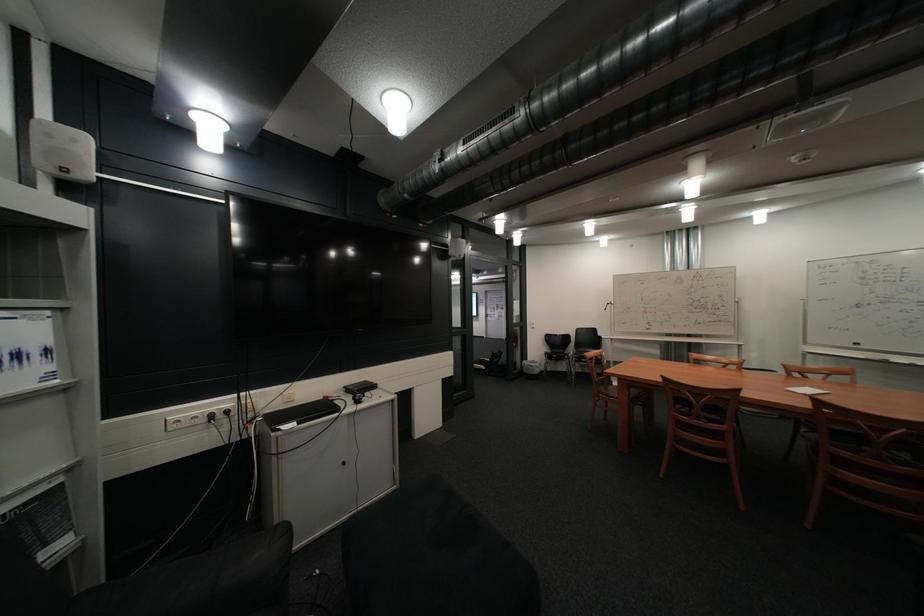
Locate an element on the screen. black sofa sitting surface is located at coordinates (432, 559).